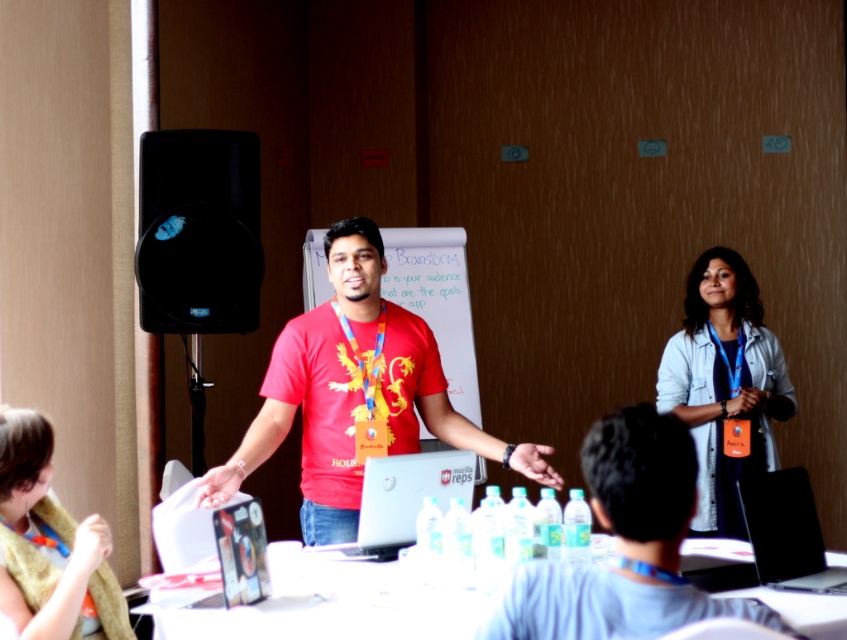
You are a participant in the presentation and need to determine which point is closer to you. The points are labeled as point at coordinates [790,410] and point at coordinates [809,538]. Which point is closer to your position?

Point at coordinates [790,410] is further to the viewer than point at coordinates [809,538]. Therefore, the point at coordinates [809,538] is closer to you.

You are organizing a presentation and need to place both the silver metallic laptop at center and the black glossy laptop at center on a shelf. The shelf has a height limit of 5 cm. Which laptop should you choose to ensure it fits within the height restriction?

The black glossy laptop at center should be chosen because it has a smaller height compared to the silver metallic laptop at center, making it more likely to fit within the 5 cm height restriction.